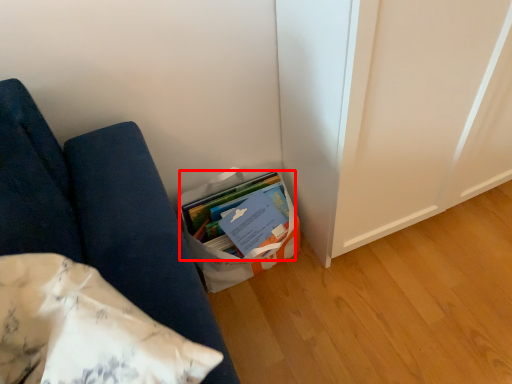
Question: From the image's perspective, where is book (annotated by the red box) located relative to furniture?

Choices:
 (A) below
 (B) above

Answer: (B)